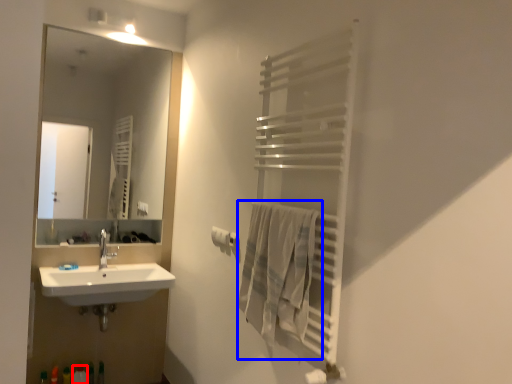
Question: Which object appears farthest to the camera in this image, toiletry (highlighted by a red box) or bath towel (highlighted by a blue box)?

Choices:
 (A) toiletry
 (B) bath towel

Answer: (A)